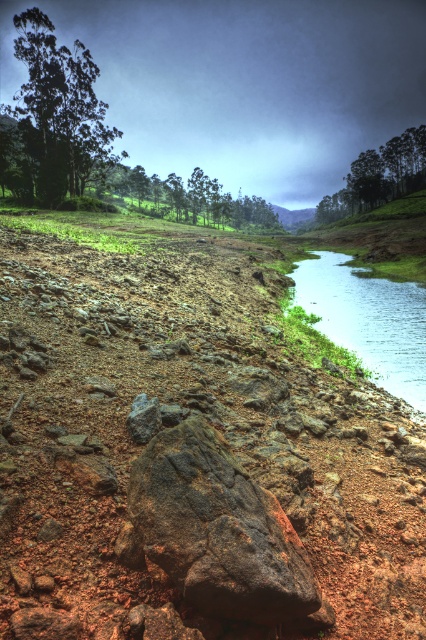
Can you confirm if rusty metallic boulder at center is thinner than green leafy tree at upper left?

Yes.

Does point (163, 536) come farther from viewer compared to point (60, 51)?

No.

The height and width of the screenshot is (640, 426). In order to click on rusty metallic boulder at center in this screenshot , I will do `click(218, 529)`.

Can you confirm if green leafy tree at upper left is wider than green matte tree at upper right?

Indeed, green leafy tree at upper left has a greater width compared to green matte tree at upper right.

Is point (78, 100) positioned before point (333, 195)?

That is True.

Does point (92, 83) lie behind point (328, 214)?

No, (92, 83) is closer to viewer.

Locate an element on the screen. This screenshot has width=426, height=640. green leafy tree at upper left is located at coordinates (54, 118).

Does rusty metallic boulder at center have a lesser width compared to clear water at river right?

Yes, rusty metallic boulder at center is thinner than clear water at river right.

Who is lower down, rusty metallic boulder at center or clear water at river right?

rusty metallic boulder at center

The height and width of the screenshot is (640, 426). What do you see at coordinates (218, 529) in the screenshot? I see `rusty metallic boulder at center` at bounding box center [218, 529].

I want to click on rusty metallic boulder at center, so click(218, 529).